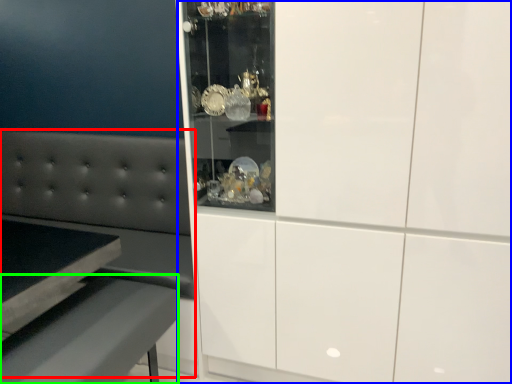
Question: Estimate the real-world distances between objects in this image. Which object is farther from couch (highlighted by a red box), cabinetry (highlighted by a blue box) or table (highlighted by a green box)?

Choices:
 (A) cabinetry
 (B) table

Answer: (A)